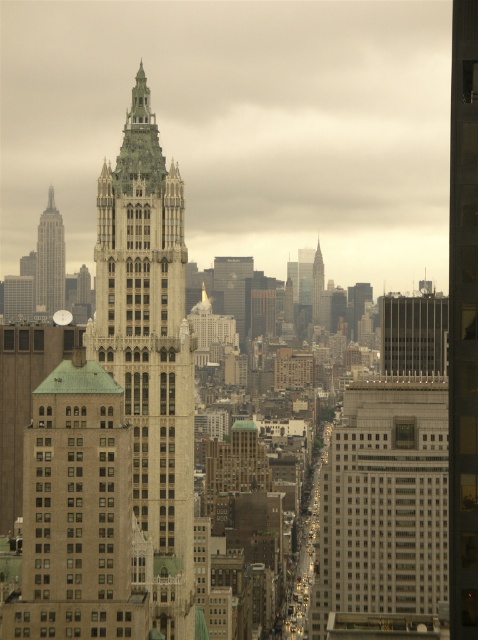
You are a drone operator planning to fly a drone between the green stone tower at center and the matte silver sphere at center. The drone has a maximum flight distance of 30 meters. Can the drone safely travel between these two landmarks without exceeding its range?

The distance between the green stone tower at center and the matte silver sphere at center is 31.56 meters, which exceeds the drone operator maximum flight range of 30 meters. Therefore, the drone cannot safely travel between these two landmarks without exceeding its range.

You are an urban planner analyzing the city layout. The green stone tower at center is part of a proposed development. Based on its position, can you determine if it is centrally located within the cityscape?

The green stone tower at center is located at point coordinates 0.550 on the x and 0.314 on the y axis, which places it near the center of the cityscape. Therefore, it can be considered centrally located.

From the picture: You are an architect evaluating the cityscape. You notice the matte silver sphere at center and the green glass skyscraper at center. Which of these two structures is taller?

The matte silver sphere at center is taller than the green glass skyscraper at center.